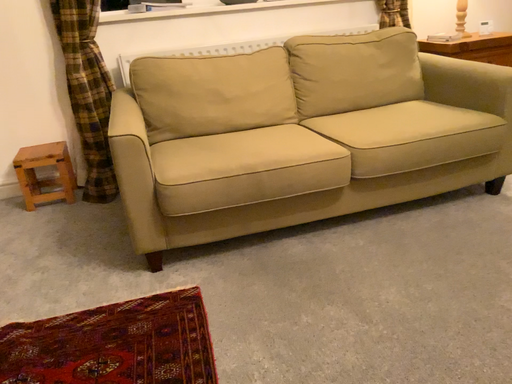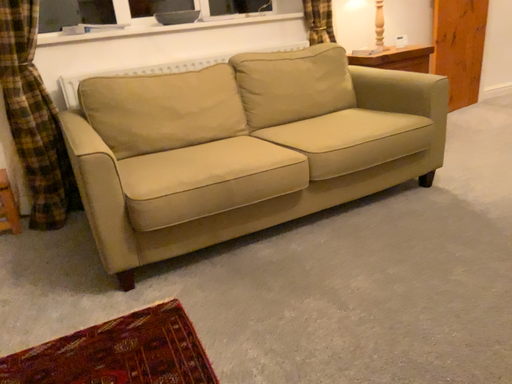
Question: Which way did the camera rotate in the video?

Choices:
 (A) rotated right
 (B) rotated left

Answer: (A)